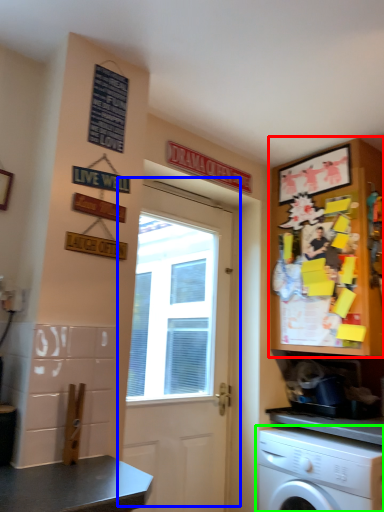
Question: Considering the real-world distances, which object is closest to cabinetry (highlighted by a red box)? door (highlighted by a blue box) or washing machine (highlighted by a green box).

Choices:
 (A) door
 (B) washing machine

Answer: (B)